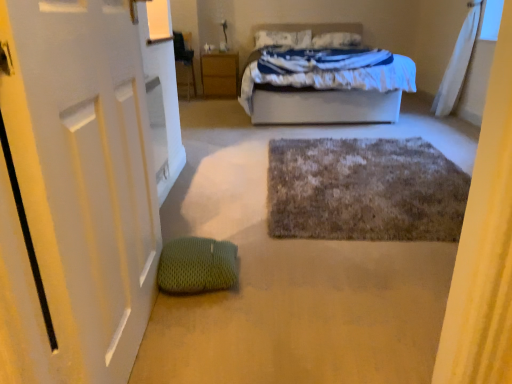
This screenshot has height=384, width=512. I want to click on vacant space underneath white matte door at left (from a real-world perspective), so click(147, 336).